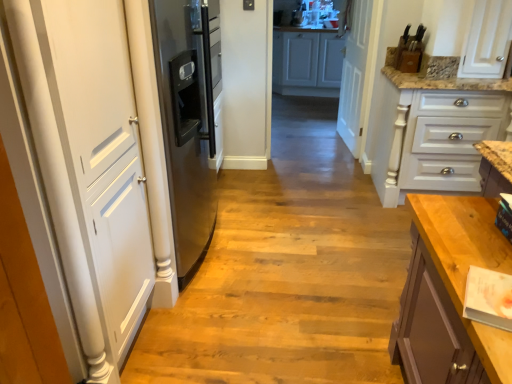
Where is `blank space above wooden floor at center (from a real-world perspective)`? The image size is (512, 384). blank space above wooden floor at center (from a real-world perspective) is located at coordinates (280, 233).